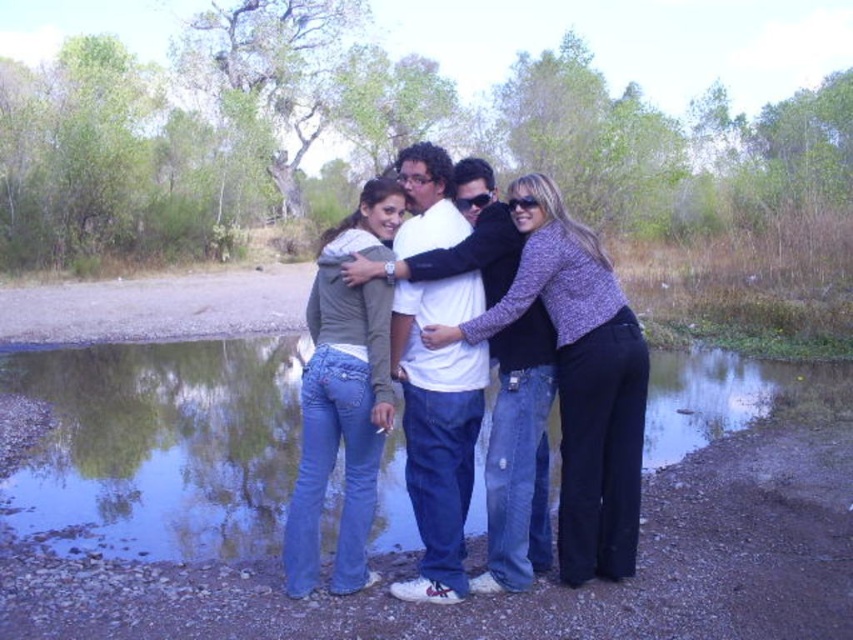
You are a photographer trying to capture the group of people standing near the water. If you focus your camera on the green reflective water at center, will the denim jeans at center still be in the background of the photo?

Yes, the denim jeans at center will still be in the background of the photo because the denim jeans at center is behind the green reflective water at center.

You are a photographer planning to take a group photo of the people in the image. You want to ensure that the denim jeans at center and the green reflective water at center are both clearly visible in the shot. Based on their heights, which object should you position closer to the camera to ensure both are visible?

The green reflective water at center is shorter than denim jeans at center. To ensure both are visible, position the denim jeans at center closer to the camera so that the shorter green reflective water at center can still be seen in the frame.

You are planning to take a photo of the green reflective water at center and denim jeans at center. Which object should you focus on first if you want to capture both in a single shot without moving the camera?

The green reflective water at center is bigger than denim jeans at center, so you should focus on the green reflective water at center first to ensure it fills the frame appropriately before adjusting for the smaller denim jeans at center.